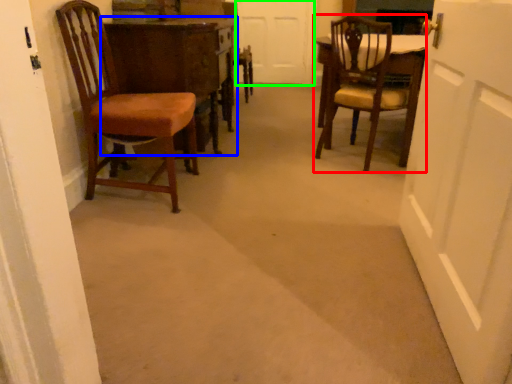
Question: Which object is positioned farthest from chair (highlighted by a red box)? Select from table (highlighted by a blue box) and door (highlighted by a green box).

Choices:
 (A) table
 (B) door

Answer: (B)